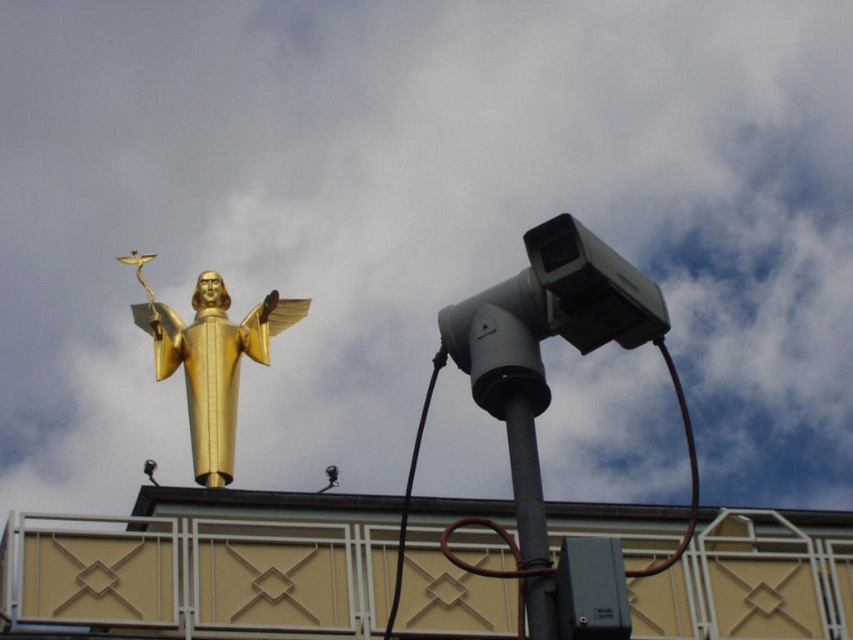
Question: Does gold polished statue at upper left appear on the left side of black metallic pole at center?

Choices:
 (A) no
 (B) yes

Answer: (B)

Question: Does gold polished statue at upper left have a lesser width compared to black metallic pole at center?

Choices:
 (A) yes
 (B) no

Answer: (B)

Question: Can you confirm if gold polished statue at upper left is positioned to the right of black metallic pole at center?

Choices:
 (A) no
 (B) yes

Answer: (A)

Question: Which object appears closest to the camera in this image?

Choices:
 (A) gold polished statue at upper left
 (B) black metallic pole at center

Answer: (B)

Question: Among these objects, which one is farthest from the camera?

Choices:
 (A) black metallic pole at center
 (B) gold polished statue at upper left

Answer: (B)

Question: Which object appears farthest from the camera in this image?

Choices:
 (A) gold polished statue at upper left
 (B) black metallic pole at center

Answer: (A)